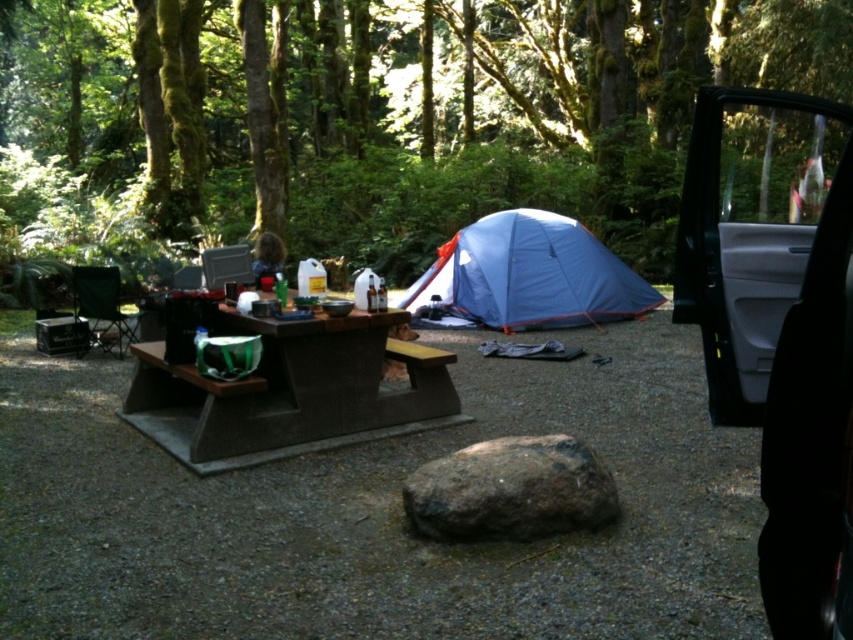
You are planning to set up a tent in this camping area. Considering the green mossy tree at upper center and the blue fabric tent at center, which object is taller?

The green mossy tree at upper center is taller than the blue fabric tent at center.

You are a camper who needs to set up a small fire pit between the blue fabric tent at center and the brown wood table at center. The fire pit requires a minimum of 2 meters of space from each structure for safety. Can you safely place the fire pit between them?

The distance between the blue fabric tent at center and the brown wood table at center is 3.36 meters. Since the fire pit needs at least 2 meters from each structure, the total required space would be 4 meters. However, the available distance is only 3.36 meters, so the fire pit cannot be placed safely between them.